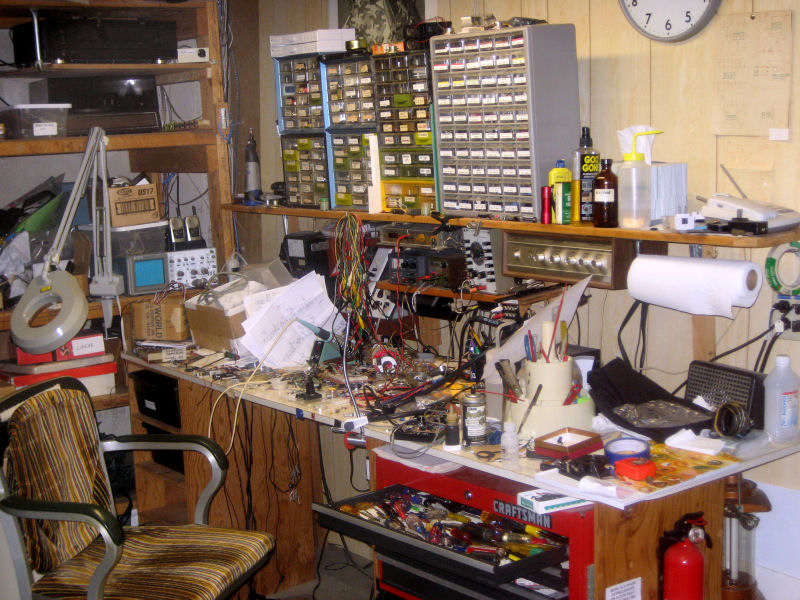
The image size is (800, 600). What are the coordinates of `paper towels` in the screenshot? It's located at (676, 271).